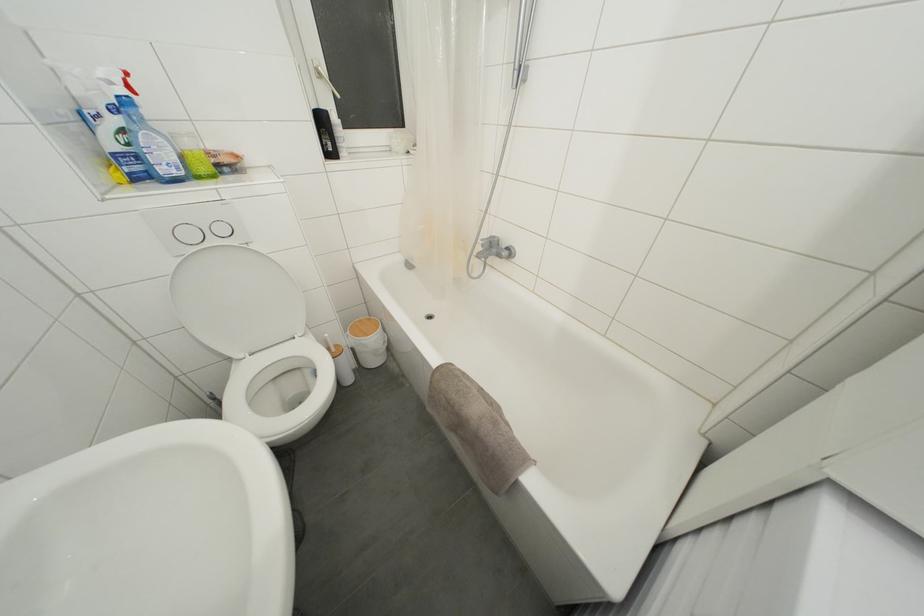
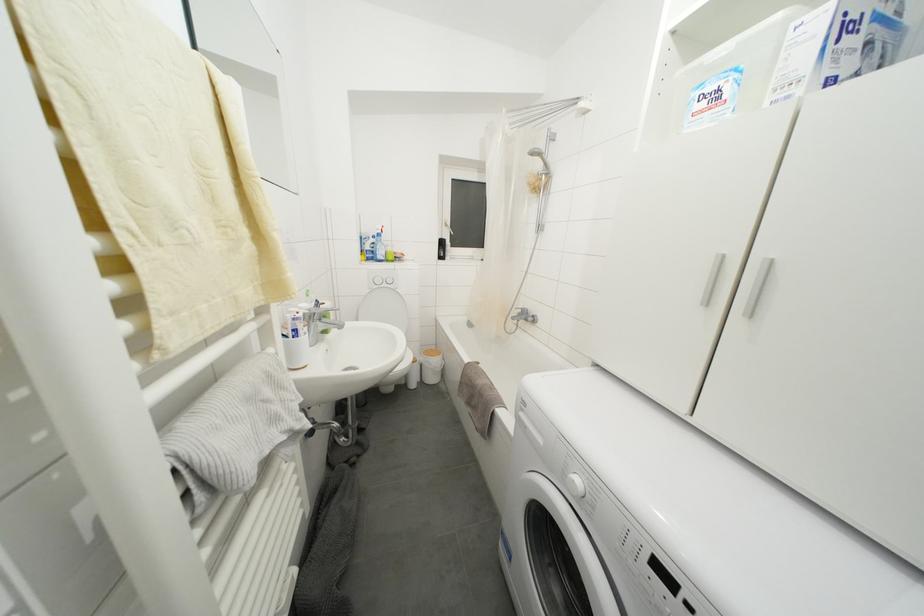
How did the camera likely rotate?

The camera rotated toward left-up.